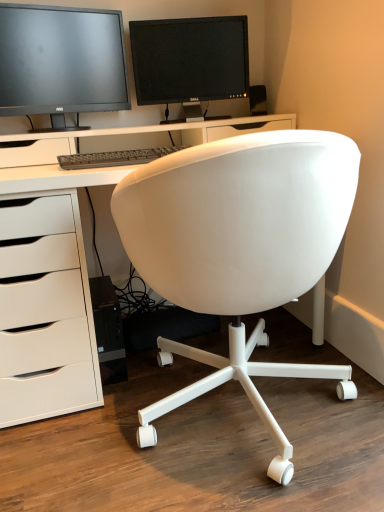
Question: From the image's perspective, is matte black monitor at upper center, the 2th computer monitor positioned from the left, under matte black monitor at upper left, arranged as the 2th computer monitor when viewed from the right?

Choices:
 (A) yes
 (B) no

Answer: (B)

Question: Is matte black monitor at upper center, the 2th computer monitor positioned from the left, looking in the opposite direction of matte black monitor at upper left, the first computer monitor viewed from the left?

Choices:
 (A) yes
 (B) no

Answer: (B)

Question: Is matte black monitor at upper center, the 2th computer monitor positioned from the left, located outside matte black monitor at upper left, the first computer monitor viewed from the left?

Choices:
 (A) no
 (B) yes

Answer: (B)

Question: Is matte black monitor at upper center, the 2th computer monitor positioned from the left, in contact with matte black monitor at upper left, the first computer monitor viewed from the left?

Choices:
 (A) no
 (B) yes

Answer: (A)

Question: From a real-world perspective, does matte black monitor at upper center, which is the first computer monitor from right to left, stand above matte black monitor at upper left, the first computer monitor viewed from the left?

Choices:
 (A) no
 (B) yes

Answer: (A)

Question: From a real-world perspective, is white matte desk at center positioned above or below matte black monitor at upper center, the 2th computer monitor positioned from the left?

Choices:
 (A) above
 (B) below

Answer: (B)

Question: Based on their sizes in the image, would you say white matte desk at center is bigger or smaller than matte black monitor at upper center, the 2th computer monitor positioned from the left?

Choices:
 (A) small
 (B) big

Answer: (B)

Question: From the image's perspective, relative to matte black monitor at upper center, the 2th computer monitor positioned from the left, is white matte desk at center above or below?

Choices:
 (A) above
 (B) below

Answer: (B)

Question: Considering the positions of white matte desk at center and matte black monitor at upper center, which is the first computer monitor from right to left, in the image, is white matte desk at center taller or shorter than matte black monitor at upper center, which is the first computer monitor from right to left,?

Choices:
 (A) tall
 (B) short

Answer: (A)

Question: Considering their positions, is matte black monitor at upper left, arranged as the 2th computer monitor when viewed from the right, located in front of or behind matte black speaker at upper right?

Choices:
 (A) front
 (B) behind

Answer: (A)

Question: From the image's perspective, relative to matte black speaker at upper right, is matte black monitor at upper left, the first computer monitor viewed from the left, above or below?

Choices:
 (A) above
 (B) below

Answer: (A)

Question: Is matte black monitor at upper left, the first computer monitor viewed from the left, taller or shorter than matte black speaker at upper right?

Choices:
 (A) short
 (B) tall

Answer: (B)

Question: In terms of width, does matte black monitor at upper left, arranged as the 2th computer monitor when viewed from the right, look wider or thinner when compared to matte black speaker at upper right?

Choices:
 (A) wide
 (B) thin

Answer: (A)

Question: From the image's perspective, is matte black monitor at upper left, the first computer monitor viewed from the left, located above or below white matte desk at center?

Choices:
 (A) above
 (B) below

Answer: (A)

Question: Is matte black monitor at upper left, arranged as the 2th computer monitor when viewed from the right, in front of or behind white matte desk at center in the image?

Choices:
 (A) front
 (B) behind

Answer: (B)